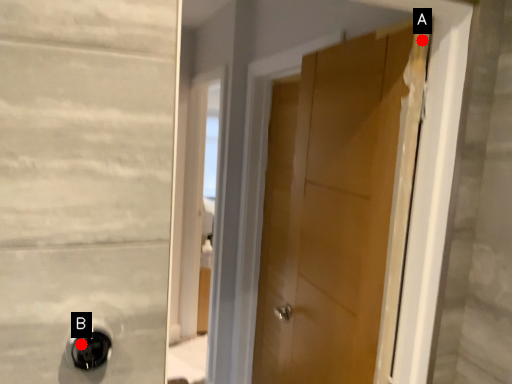
Question: Two points are circled on the image, labeled by A and B beside each circle. Which of the following is the farthest from the observer?

Choices:
 (A) A is further
 (B) B is further

Answer: (A)